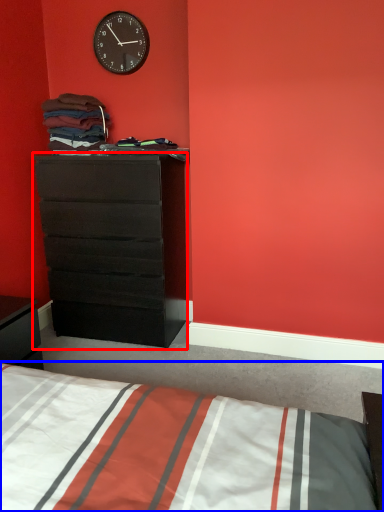
Question: Which point is closer to the camera, chest of drawers (highlighted by a red box) or bed (highlighted by a blue box)?

Choices:
 (A) chest of drawers
 (B) bed

Answer: (B)